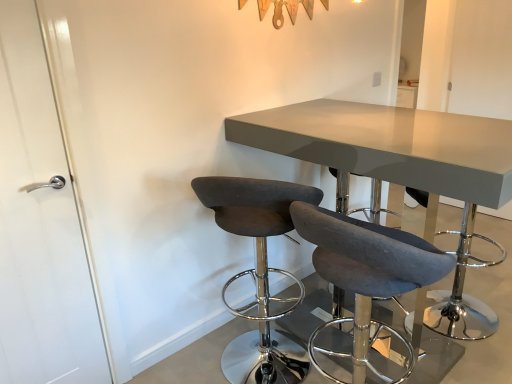
Question: Is matte gray table at center aimed at white glossy door at left?

Choices:
 (A) yes
 (B) no

Answer: (B)

Question: Is white glossy door at left a part of matte gray table at center?

Choices:
 (A) yes
 (B) no

Answer: (B)

Question: From the image's perspective, is matte gray table at center located beneath white glossy door at left?

Choices:
 (A) no
 (B) yes

Answer: (B)

Question: Is matte gray table at center next to white glossy door at left and touching it?

Choices:
 (A) yes
 (B) no

Answer: (B)

Question: Is matte gray table at center positioned behind white glossy door at left?

Choices:
 (A) no
 (B) yes

Answer: (A)

Question: Is matte gray table at center to the left or to the right of white glossy door at left in the image?

Choices:
 (A) right
 (B) left

Answer: (A)

Question: Considering the positions of point (396, 114) and point (0, 107), is point (396, 114) closer or farther from the camera than point (0, 107)?

Choices:
 (A) closer
 (B) farther

Answer: (B)

Question: From the image's perspective, relative to white glossy door at left, is matte gray table at center above or below?

Choices:
 (A) below
 (B) above

Answer: (A)

Question: Considering the positions of matte gray table at center and white glossy door at left in the image, is matte gray table at center bigger or smaller than white glossy door at left?

Choices:
 (A) big
 (B) small

Answer: (A)

Question: Which is correct: dark gray fabric stool at center, the first chair positioned from the left, is inside matte gray table at center, or outside of it?

Choices:
 (A) outside
 (B) inside

Answer: (A)

Question: Is dark gray fabric stool at center, the first chair positioned from the left, taller or shorter than matte gray table at center?

Choices:
 (A) short
 (B) tall

Answer: (A)

Question: In the image, is dark gray fabric stool at center, the first chair positioned from the left, positioned in front of or behind matte gray table at center?

Choices:
 (A) behind
 (B) front

Answer: (A)

Question: In terms of size, does dark gray fabric stool at center, the second chair viewed from the right, appear bigger or smaller than matte gray table at center?

Choices:
 (A) small
 (B) big

Answer: (A)

Question: Would you say gray fabric bar stool at center is to the left or to the right of matte gray table at center in the picture?

Choices:
 (A) left
 (B) right

Answer: (B)

Question: Would you say gray fabric bar stool at center is inside or outside matte gray table at center?

Choices:
 (A) inside
 (B) outside

Answer: (B)